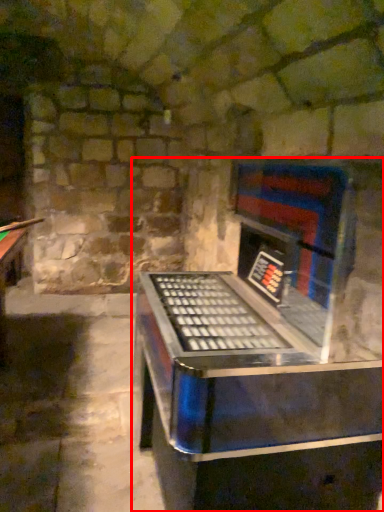
Question: From the image's perspective, where is furniture (annotated by the red box) located in relation to cue in the image?

Choices:
 (A) above
 (B) below

Answer: (B)